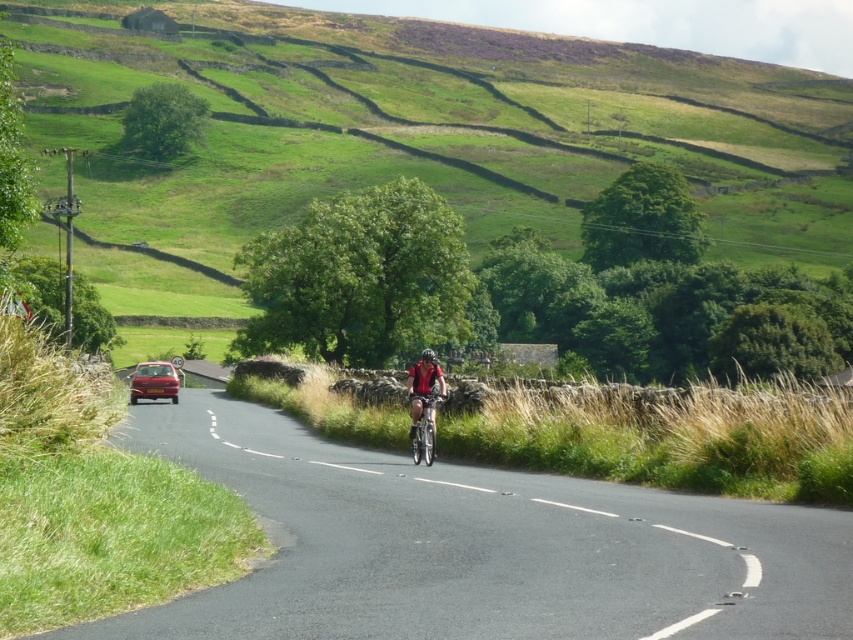
In the scene shown: You are a cyclist on the right side of the road and see the point marked at coordinates (154, 381). What object is located at that point?

The point at coordinates (154, 381) indicates a metallic red car at left.